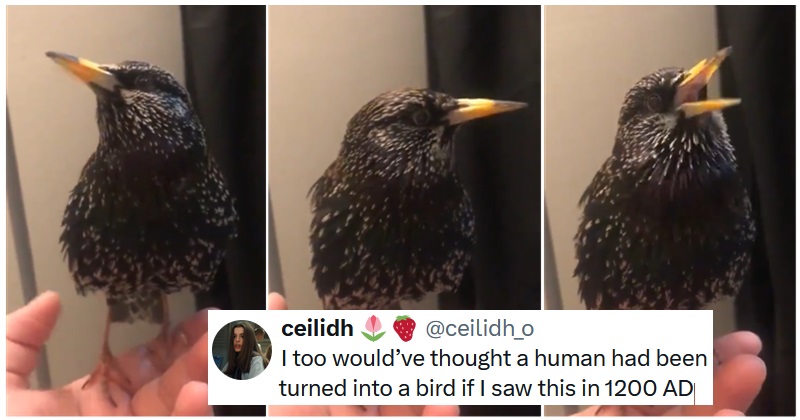
You are a GUI agent. You are given a task and a screenshot of the screen. Output one action in this format:
    pyautogui.click(x=<x>, y=<y>)
    Task: Click on the light wall
    This screenshot has height=420, width=800.
    Given the screenshot: What is the action you would take?
    pyautogui.click(x=550, y=41)